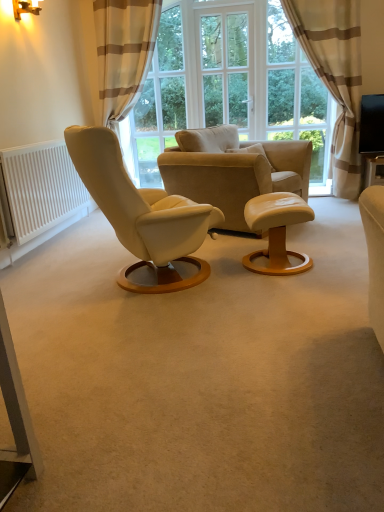
Locate an element on the screen. This screenshot has width=384, height=512. free spot in front of white matte radiator at left is located at coordinates (68, 264).